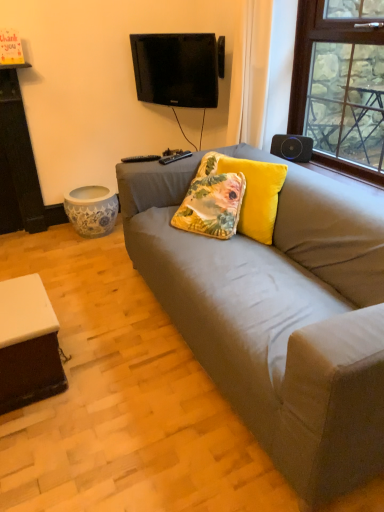
Where is `free space above white matte table at lower left (from a real-world perspective)`? This screenshot has width=384, height=512. free space above white matte table at lower left (from a real-world perspective) is located at coordinates (26, 291).